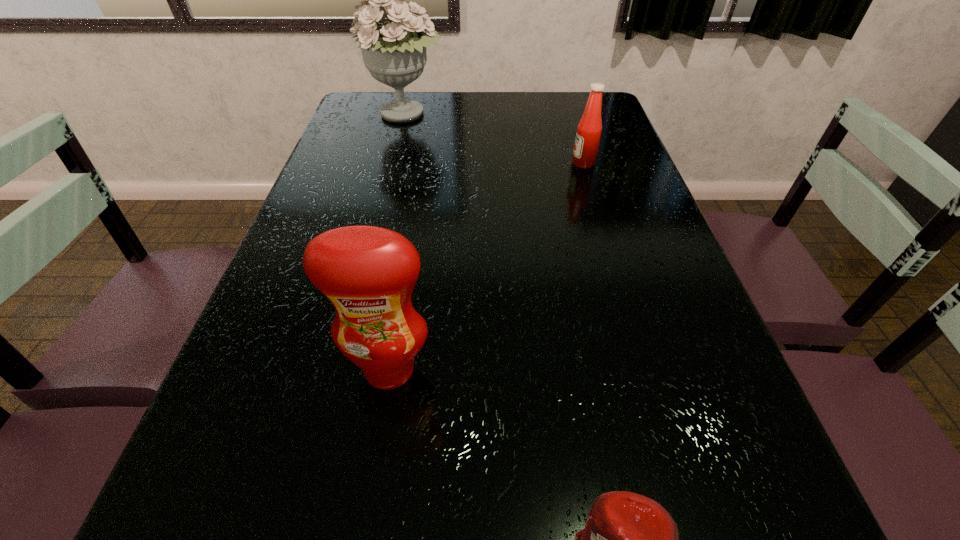
This screenshot has height=540, width=960. Identify the location of unoccupied area between the rightmost condiment and the bouquet. (494, 139).

Where is `free space between the rightmost condiment and the farthest object`? free space between the rightmost condiment and the farthest object is located at coordinates (494, 139).

At what (x,y) coordinates should I click in order to perform the action: click on the closest object relative to the farthest object. Please return your answer as a coordinate pair (x, y). Image resolution: width=960 pixels, height=540 pixels. Looking at the image, I should click on [587, 140].

You are a GUI agent. You are given a task and a screenshot of the screen. Output one action in this format:
    pyautogui.click(x=<x>, y=<y>)
    Task: Click on the object that can be found as the closest to the leftmost condiment
    This screenshot has height=540, width=960.
    Given the screenshot: What is the action you would take?
    pyautogui.click(x=629, y=539)

At what (x,y) coordinates should I click in order to perform the action: click on condiment that is the second nearest to the second object from right to left. Please return your answer as a coordinate pair (x, y). Looking at the image, I should click on (587, 140).

Where is `the third closest condiment relative to the bouquet`? the third closest condiment relative to the bouquet is located at coordinates (629, 539).